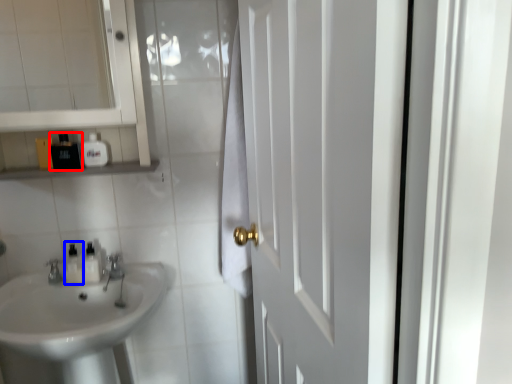
Question: Which object appears farthest to the camera in this image, toiletry (highlighted by a red box) or toiletry (highlighted by a blue box)?

Choices:
 (A) toiletry
 (B) toiletry

Answer: (B)